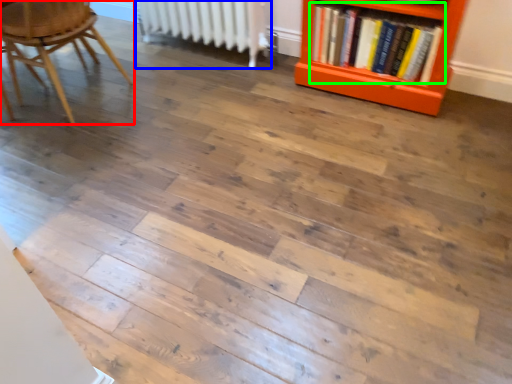
Question: Which is nearer to the chair (highlighted by a red box)? radiator (highlighted by a blue box) or book (highlighted by a green box).

Choices:
 (A) radiator
 (B) book

Answer: (A)